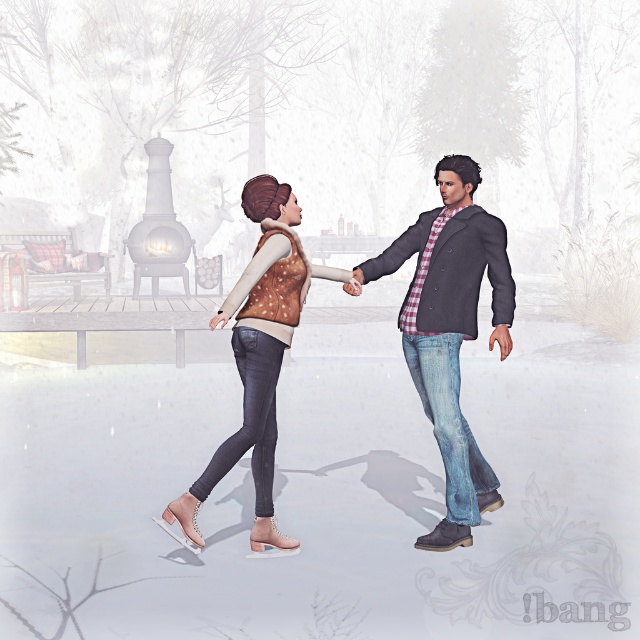
Which of these two, matte brown vest at center or denim jacket at right, stands shorter?

denim jacket at right

Measure the distance between matte brown vest at center and camera.

matte brown vest at center is 16.67 feet from camera.

I want to click on matte brown vest at center, so click(401, 339).

This screenshot has width=640, height=640. Find the location of `matte brown vest at center`. matte brown vest at center is located at coordinates (401, 339).